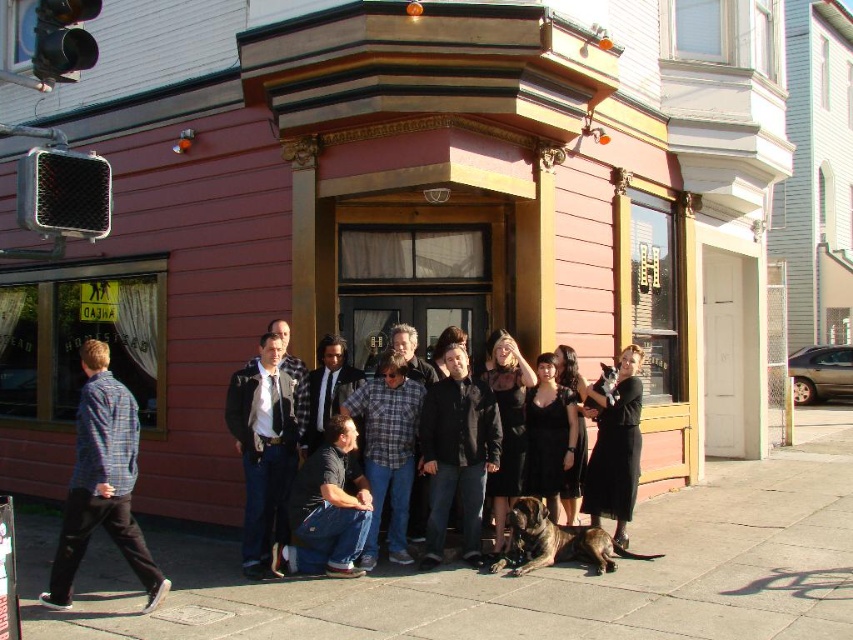
Question: Is dark gray jacket at center bigger than plaid shirt at center?

Choices:
 (A) no
 (B) yes

Answer: (A)

Question: Can you confirm if plaid shirt at center is positioned above black lace dress at center?

Choices:
 (A) no
 (B) yes

Answer: (A)

Question: Does black dress at center appear on the left side of black lace dress at center?

Choices:
 (A) yes
 (B) no

Answer: (B)

Question: Which of these objects is positioned farthest from the black leather jacket at center?

Choices:
 (A) plaid shirt at center
 (B) matte black jacket at center
 (C) black satin dress at center

Answer: (B)

Question: Which point is farther to the camera?

Choices:
 (A) (345, 547)
 (B) (274, 435)
 (C) (384, 630)
 (D) (566, 458)

Answer: (D)

Question: Which object is positioned closest to the dark gray jacket at center?

Choices:
 (A) blue plaid shirt at left
 (B) concrete sidewalk at center
 (C) denim jeans at center

Answer: (C)